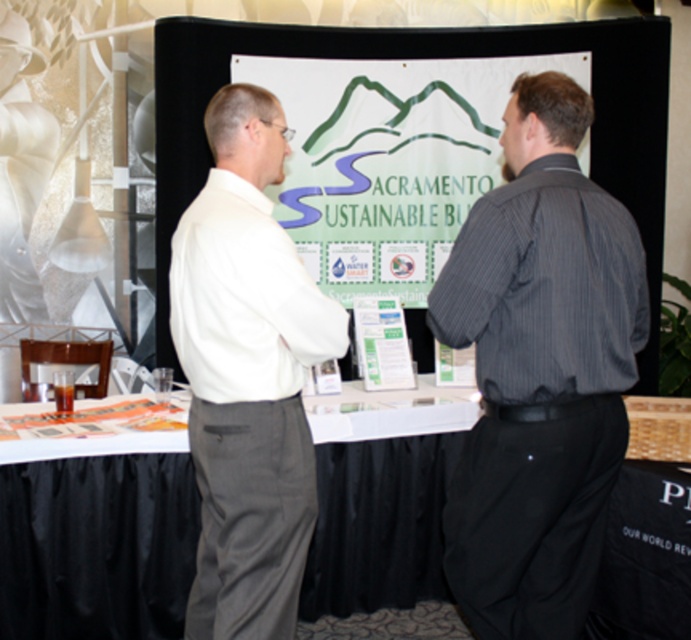
Question: Based on their relative distances, which object is nearer to the white paper at center?

Choices:
 (A) dark gray striped shirt at center
 (B) white cotton shirt at center

Answer: (B)

Question: Can you confirm if white paper at center is smaller than white cotton shirt at center?

Choices:
 (A) no
 (B) yes

Answer: (B)

Question: Among these points, which one is farthest from the camera?

Choices:
 (A) (331, 474)
 (B) (536, 625)

Answer: (A)

Question: Where is dark gray striped shirt at center located in relation to white paper at center in the image?

Choices:
 (A) below
 (B) above

Answer: (B)

Question: Estimate the real-world distances between objects in this image. Which object is closer to the white paper at center?

Choices:
 (A) dark gray striped shirt at center
 (B) white cotton shirt at center

Answer: (B)

Question: Is white paper at center further to camera compared to white cotton shirt at center?

Choices:
 (A) no
 (B) yes

Answer: (B)